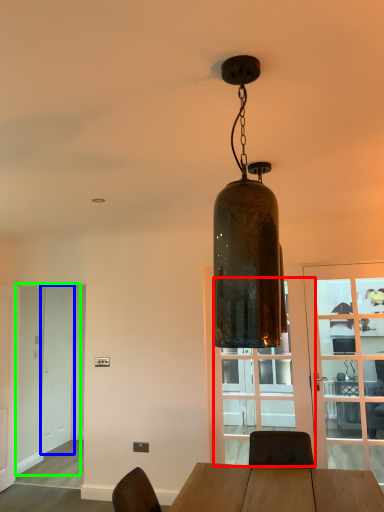
Question: Estimate the real-world distances between objects in this image. Which object is closer to glass door (highlighted by a red box), screen door (highlighted by a blue box) or screen door (highlighted by a green box)?

Choices:
 (A) screen door
 (B) screen door

Answer: (B)